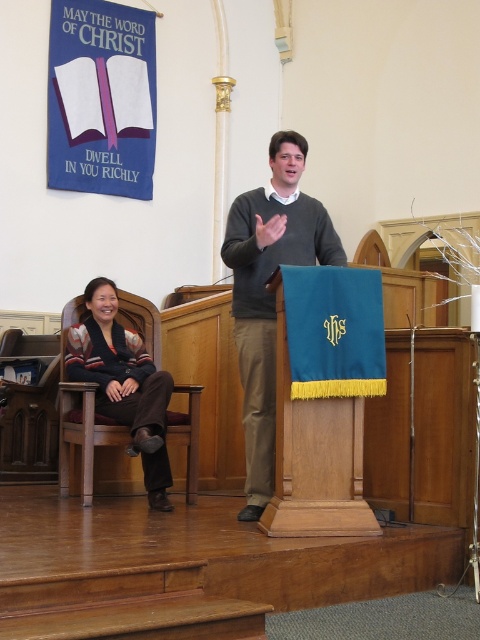
Which is behind, point (273, 268) or point (84, 333)?

Positioned behind is point (84, 333).

Where is `dark gray sweater at center`? dark gray sweater at center is located at coordinates (269, 292).

Does point (296, 262) come closer to viewer compared to point (130, 403)?

Yes, point (296, 262) is closer to viewer.

Locate an element on the screen. dark gray sweater at center is located at coordinates (269, 292).